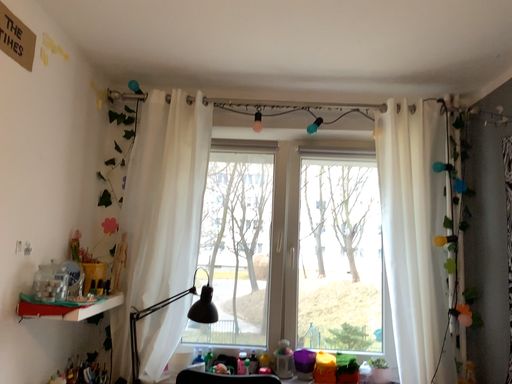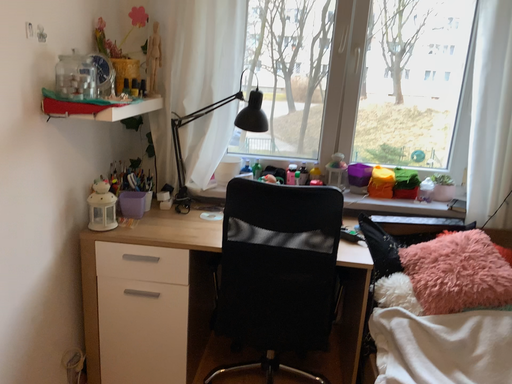
Question: Which way did the camera rotate in the video?

Choices:
 (A) rotated downward
 (B) rotated upward

Answer: (A)